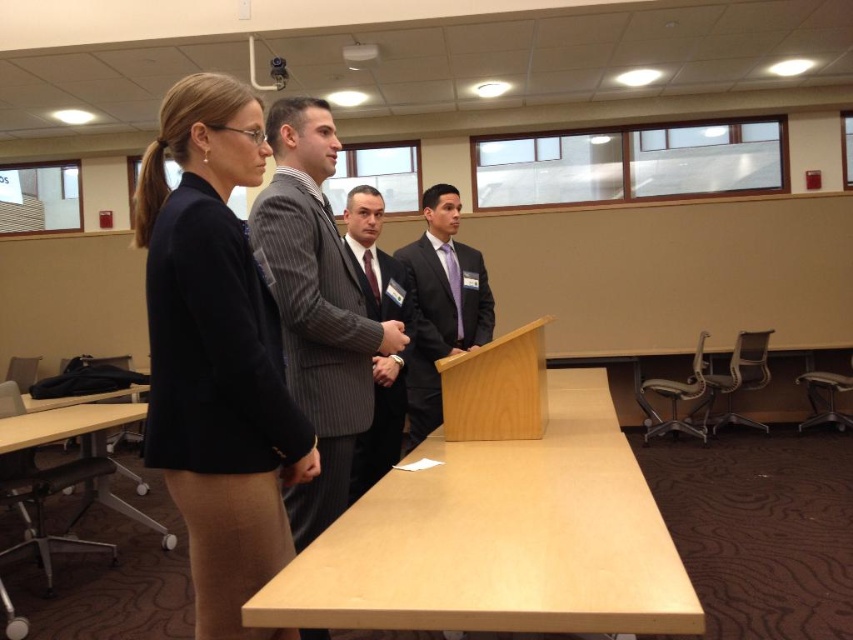
You are organizing a presentation and need to ensure there is enough space between the light wood podium at center and the pinstriped wool suit at center for attendees to move comfortably. The minimum required space is 24 inches. Based on the image, is the current spacing sufficient?

The light wood podium at center and pinstriped wool suit at center are 22.98 inches apart, which is less than the required 24 inches. Therefore, the current spacing is insufficient for comfortable movement.

You are standing in the conference room and want to determine which of the two points, point (x=299, y=422) or point (x=392, y=264), is nearer to you. Based on the scene description, which point is closer?

Point (x=299, y=422) is closer to the camera than point (x=392, y=264), so it is the nearer point.

You are standing in the conference room and see two points marked on the floor. The first point is at coordinate point (245, 100) and the second is at point (444, 312). Which point is nearer to you?

Point (245, 100) is closer to the viewer than point (444, 312).